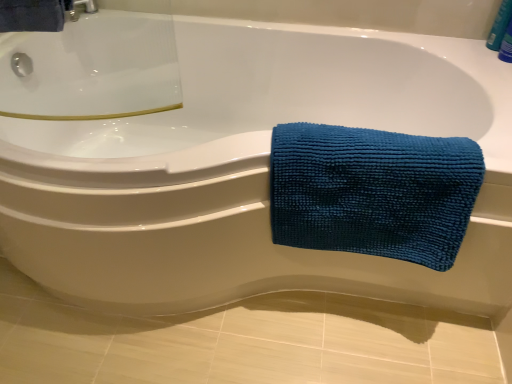
Question: Considering the relative sizes of teal microfiber towel at right and blue plastic bottle at upper right in the image provided, is teal microfiber towel at right thinner than blue plastic bottle at upper right?

Choices:
 (A) no
 (B) yes

Answer: (A)

Question: Can you confirm if teal microfiber towel at right is positioned to the right of blue plastic bottle at upper right?

Choices:
 (A) no
 (B) yes

Answer: (A)

Question: From the image's perspective, would you say teal microfiber towel at right is shown under blue plastic bottle at upper right?

Choices:
 (A) no
 (B) yes

Answer: (B)

Question: Is teal microfiber towel at right oriented towards blue plastic bottle at upper right?

Choices:
 (A) no
 (B) yes

Answer: (A)

Question: Is teal microfiber towel at right closer to the viewer compared to blue plastic bottle at upper right?

Choices:
 (A) no
 (B) yes

Answer: (B)

Question: Could blue plastic bottle at upper right be considered to be inside teal microfiber towel at right?

Choices:
 (A) no
 (B) yes

Answer: (A)

Question: Is blue plastic bottle at upper right thinner than teal microfiber towel at right?

Choices:
 (A) yes
 (B) no

Answer: (A)

Question: From the image's perspective, is blue plastic bottle at upper right beneath teal microfiber towel at right?

Choices:
 (A) yes
 (B) no

Answer: (B)

Question: Is teal microfiber towel at right at the back of blue plastic bottle at upper right?

Choices:
 (A) yes
 (B) no

Answer: (B)

Question: From a real-world perspective, is blue plastic bottle at upper right on top of teal microfiber towel at right?

Choices:
 (A) yes
 (B) no

Answer: (A)

Question: From a real-world perspective, is blue plastic bottle at upper right positioned under teal microfiber towel at right based on gravity?

Choices:
 (A) no
 (B) yes

Answer: (A)

Question: Can you confirm if blue plastic bottle at upper right is positioned to the right of teal microfiber towel at right?

Choices:
 (A) yes
 (B) no

Answer: (A)

Question: In terms of width, does blue plastic bottle at upper right look wider or thinner when compared to teal microfiber towel at right?

Choices:
 (A) wide
 (B) thin

Answer: (B)